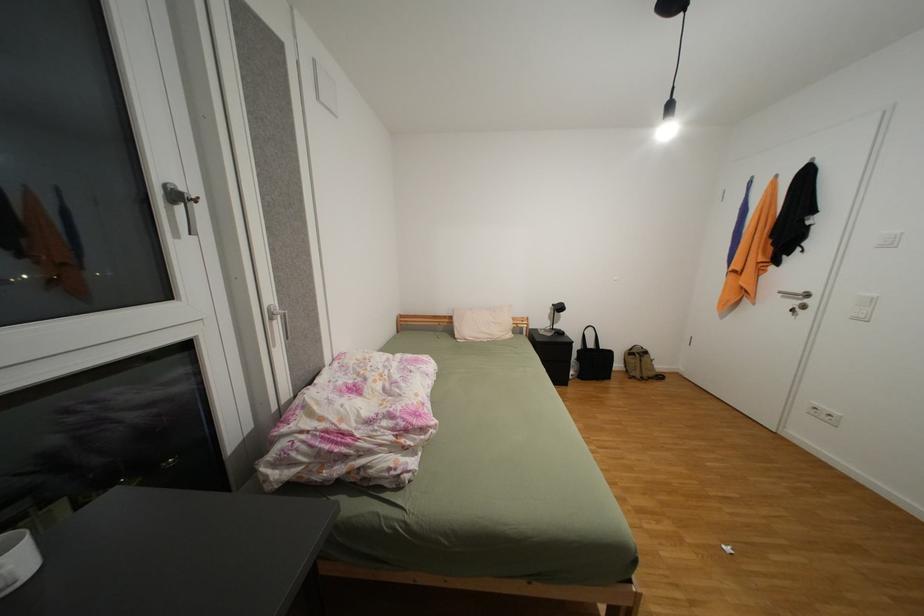
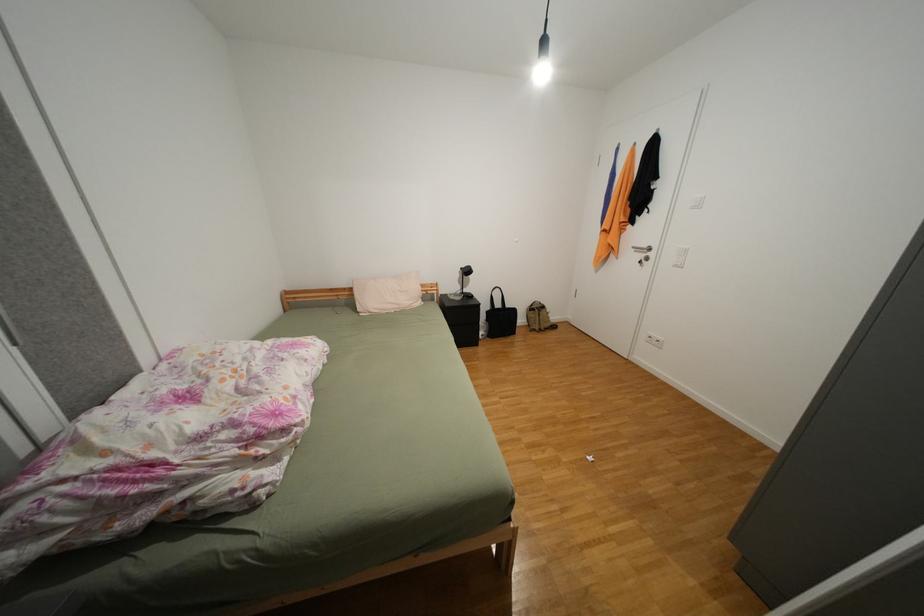
Which direction would the cameraman need to move to produce the second image?

The cameraman walked toward right, forward.